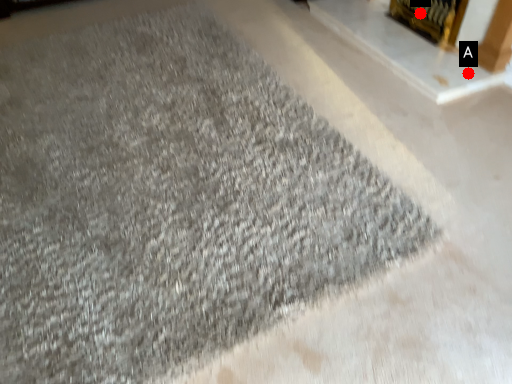
Question: Two points are circled on the image, labeled by A and B beside each circle. Which point is further to the camera?

Choices:
 (A) A is further
 (B) B is further

Answer: (B)